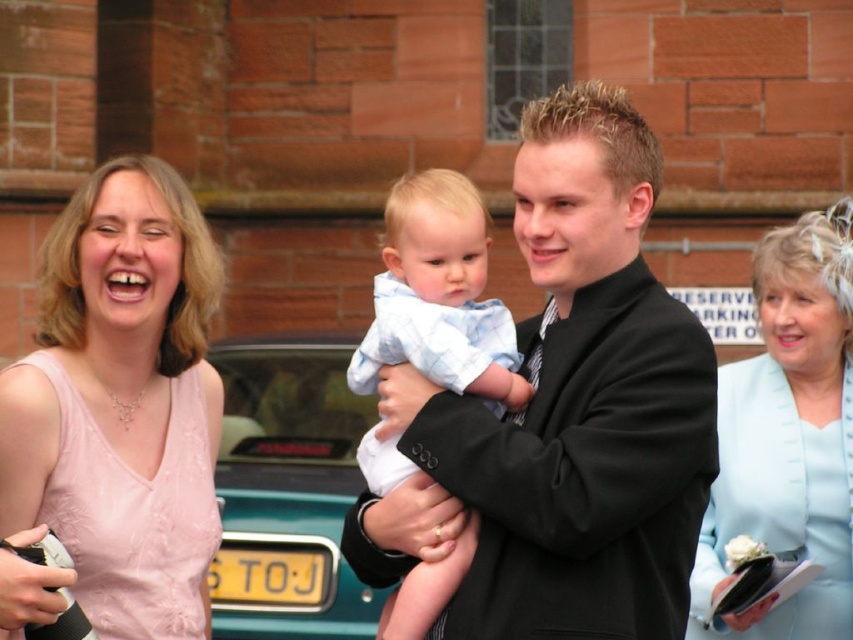
Does black suit at center have a lesser height compared to green metallic car at center?

In fact, black suit at center may be taller than green metallic car at center.

Image resolution: width=853 pixels, height=640 pixels. Describe the element at coordinates (566, 413) in the screenshot. I see `black suit at center` at that location.

You are a GUI agent. You are given a task and a screenshot of the screen. Output one action in this format:
    pyautogui.click(x=<x>, y=<y>)
    Task: Click on the black suit at center
    The height and width of the screenshot is (640, 853).
    Given the screenshot: What is the action you would take?
    pyautogui.click(x=566, y=413)

Who is lower down, pink satin dress at upper left or green metallic car at center?

green metallic car at center is below.

Who is shorter, pink satin dress at upper left or green metallic car at center?

With less height is green metallic car at center.

Identify the location of pink satin dress at upper left. (122, 401).

The width and height of the screenshot is (853, 640). In order to click on pink satin dress at upper left in this screenshot , I will do `click(122, 401)`.

Is green metallic car at center bigger than light blue cotton shirt at center?

No, green metallic car at center is not bigger than light blue cotton shirt at center.

Does green metallic car at center appear over light blue cotton shirt at center?

No, green metallic car at center is not above light blue cotton shirt at center.

Locate an element on the screen. Image resolution: width=853 pixels, height=640 pixels. green metallic car at center is located at coordinates (288, 490).

Identify the location of green metallic car at center. (288, 490).